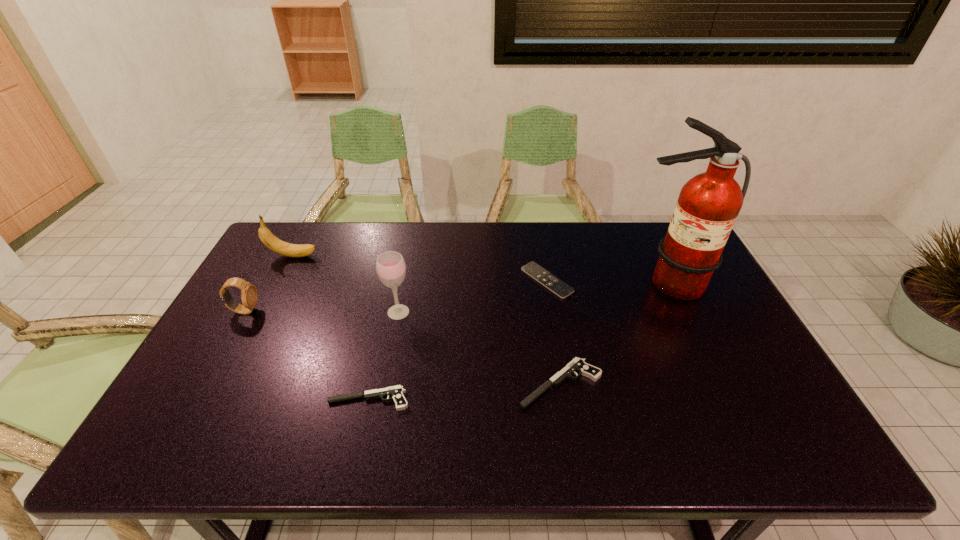
Given the evenly spaced pistols in the image, where should an extra pistol be added on the right to preserve the spacing? Please point to a vacant space. Please provide its 2D coordinates. Your answer should be formatted as a tuple, i.e. [(x, y)], where the tuple contains the x and y coordinates of a point satisfying the conditions above.

[(740, 369)]